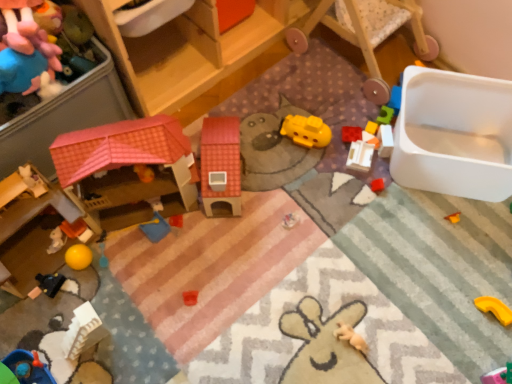
The height and width of the screenshot is (384, 512). Find the location of `vacant area that lies to the right of white plastic blocks at right, placed as the tenth toy when sorted from left to right`. vacant area that lies to the right of white plastic blocks at right, placed as the tenth toy when sorted from left to right is located at coordinates (429, 139).